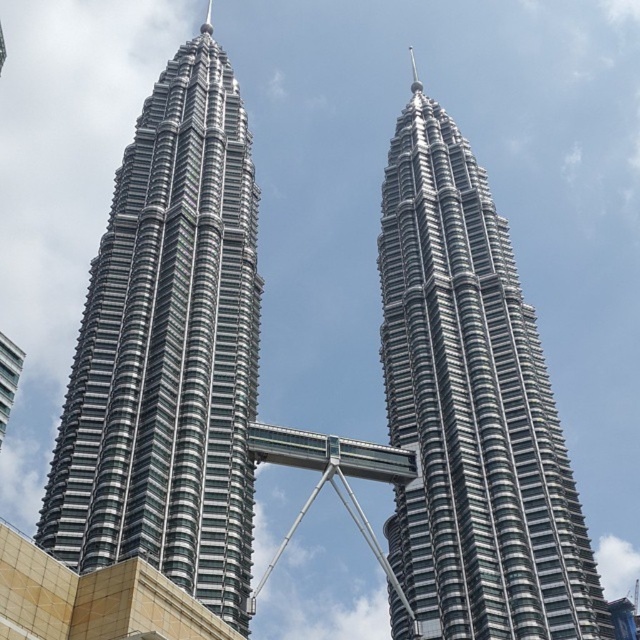
Question: Which point is closer to the camera taking this photo?

Choices:
 (A) (403, 406)
 (B) (152, 160)

Answer: (A)

Question: Which point is closer to the camera taking this photo?

Choices:
 (A) (397, 289)
 (B) (125, 296)

Answer: (B)

Question: Is silver glass skyscraper at center to the right of metallic glass skyscraper at center from the viewer's perspective?

Choices:
 (A) yes
 (B) no

Answer: (B)

Question: Is silver glass skyscraper at center smaller than metallic glass skyscraper at center?

Choices:
 (A) yes
 (B) no

Answer: (B)

Question: Can you confirm if silver glass skyscraper at center is thinner than metallic glass skyscraper at center?

Choices:
 (A) yes
 (B) no

Answer: (B)

Question: Which point is farther to the camera?

Choices:
 (A) metallic glass skyscraper at center
 (B) silver glass skyscraper at center

Answer: (A)